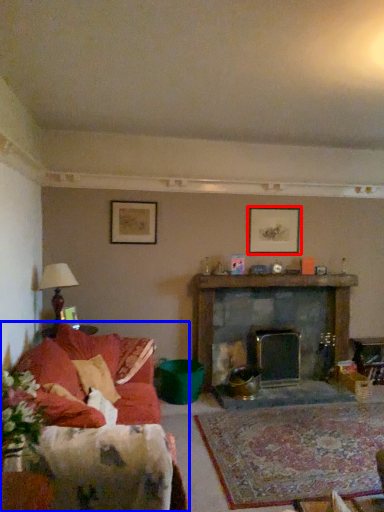
Question: Which of the following is the farthest to the observer, picture frame (highlighted by a red box) or studio couch (highlighted by a blue box)?

Choices:
 (A) picture frame
 (B) studio couch

Answer: (A)